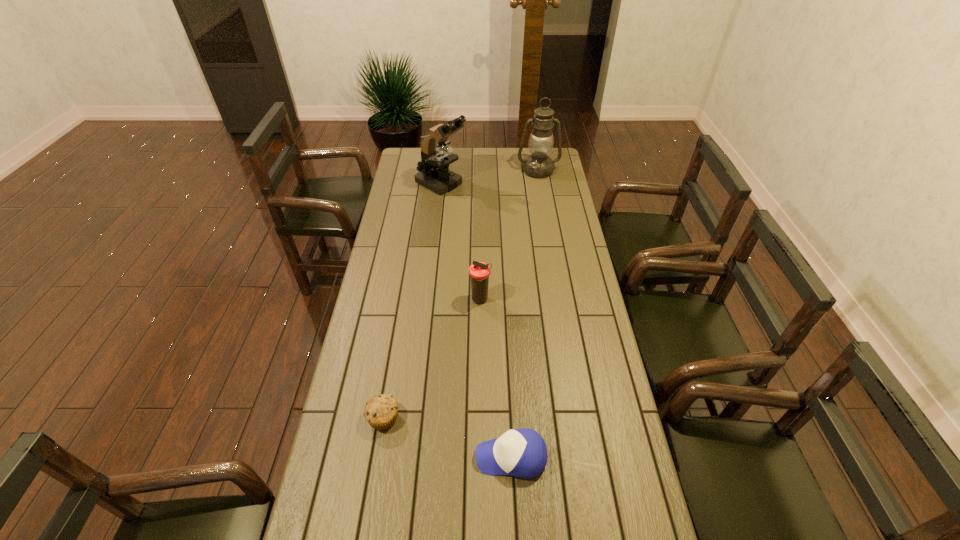
You are a GUI agent. You are given a task and a screenshot of the screen. Output one action in this format:
    pyautogui.click(x=<x>, y=<y>)
    Task: Click on the vacant space positioned 0.270m on the front-facing side of the nearest object
    
    Given the screenshot: What is the action you would take?
    pyautogui.click(x=378, y=456)

You are a GUI agent. You are given a task and a screenshot of the screen. Output one action in this format:
    pyautogui.click(x=<x>, y=<y>)
    Task: Click on the free region located on the front-facing side of the nearest object
    This screenshot has height=540, width=960.
    Given the screenshot: What is the action you would take?
    pyautogui.click(x=450, y=456)

Where is `vacant space located 0.190m on the front of the muffin`? This screenshot has height=540, width=960. vacant space located 0.190m on the front of the muffin is located at coordinates (369, 503).

Image resolution: width=960 pixels, height=540 pixels. Find the location of `oil lamp that is positioned at the far edge`. oil lamp that is positioned at the far edge is located at coordinates click(539, 165).

I want to click on microscope that is at the far edge, so click(434, 174).

What are the coordinates of `microscope that is at the left edge` in the screenshot? It's located at (434, 174).

Where is `muffin located in the left edge section of the desktop`? The width and height of the screenshot is (960, 540). muffin located in the left edge section of the desktop is located at coordinates (380, 412).

Find the location of a particular element. This screenshot has height=540, width=960. object that is at the right edge is located at coordinates (539, 165).

Locate an element on the screen. object that is positioned at the far left corner is located at coordinates (434, 174).

Image resolution: width=960 pixels, height=540 pixels. I want to click on object at the far right corner, so click(539, 165).